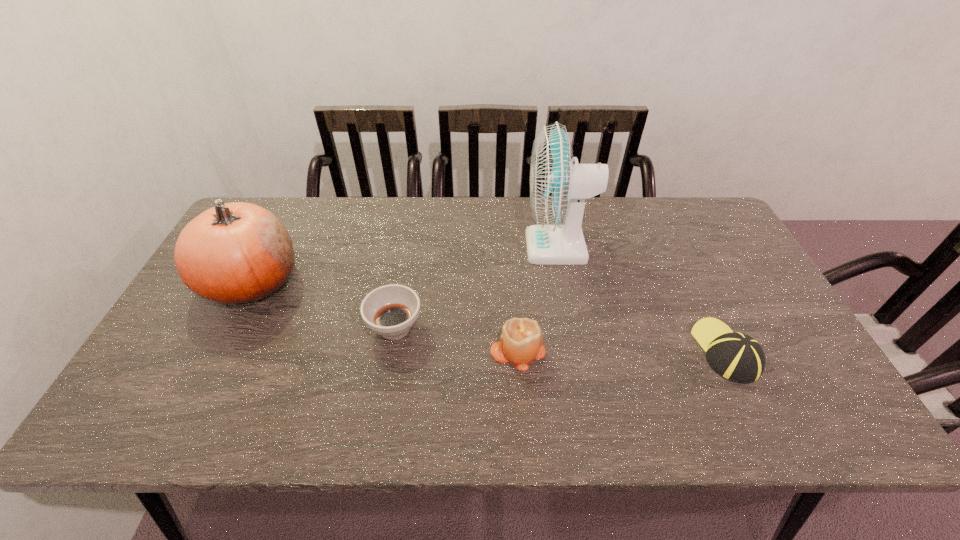
The height and width of the screenshot is (540, 960). What are the coordinates of `free space between the rightmost object and the candle` in the screenshot? It's located at (x=622, y=350).

Locate an element on the screen. The height and width of the screenshot is (540, 960). vacant region between the soup bowl and the baseball cap is located at coordinates (561, 339).

Where is `vacant area that lies between the third tallest object and the fan`? This screenshot has height=540, width=960. vacant area that lies between the third tallest object and the fan is located at coordinates (538, 299).

Point out which object is positioned as the fourth nearest to the second tallest object. Please provide its 2D coordinates. Your answer should be formatted as a tuple, i.e. [(x, y)], where the tuple contains the x and y coordinates of a point satisfying the conditions above.

[(737, 357)]

Locate an element on the screen. The image size is (960, 540). object that is the third nearest to the fan is located at coordinates [x=391, y=310].

Where is `free spot that satisfies the following two spatial constraints: 1. with the brim of the rightmost object facing forward; 2. in front of the tallest object to face the airflow`? This screenshot has width=960, height=540. free spot that satisfies the following two spatial constraints: 1. with the brim of the rightmost object facing forward; 2. in front of the tallest object to face the airflow is located at coordinates (676, 247).

You are a GUI agent. You are given a task and a screenshot of the screen. Output one action in this format:
    pyautogui.click(x=<x>, y=<y>)
    Task: Click on the vacant position in the image that satisfies the following two spatial constraints: 1. in front of the fan to face the airflow; 2. on the front side of the pumpkin
    The height and width of the screenshot is (540, 960).
    Given the screenshot: What is the action you would take?
    pyautogui.click(x=564, y=280)

Locate an element on the screen. This screenshot has height=540, width=960. vacant space that satisfies the following two spatial constraints: 1. on the front side of the second object from left to right; 2. on the right side of the candle is located at coordinates (391, 350).

Find the location of a particular element. This screenshot has height=540, width=960. free space that satisfies the following two spatial constraints: 1. in front of the tallest object to face the airflow; 2. with the brim of the baseball cap facing forward is located at coordinates (577, 351).